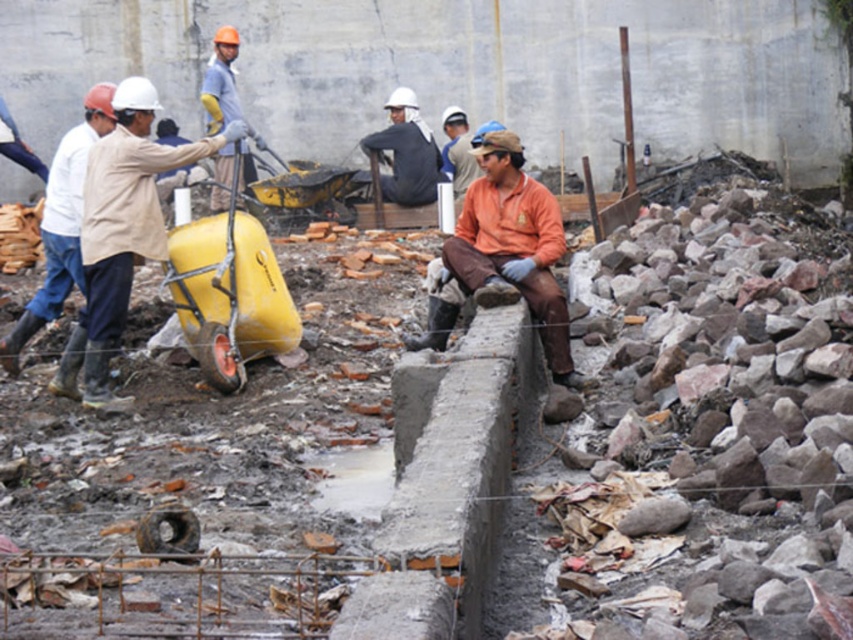
You are a construction worker who needs to lift the dark gray fabric shirt at center onto the matte yellow wheelbarrow at left. Can you do this without needing to adjust the height of either object?

The matte yellow wheelbarrow at left is taller than the dark gray fabric shirt at center, so you can lift the dark gray fabric shirt at center onto the matte yellow wheelbarrow at left without needing to adjust their heights.

You are a construction worker needing to choose between the orange fabric shirt at center and the matte gray shirt at upper center for a task requiring flexibility in movement. Which shirt would allow for more mobility due to its size?

The orange fabric shirt at center has a larger width than the matte gray shirt at upper center, so it would allow for more mobility.